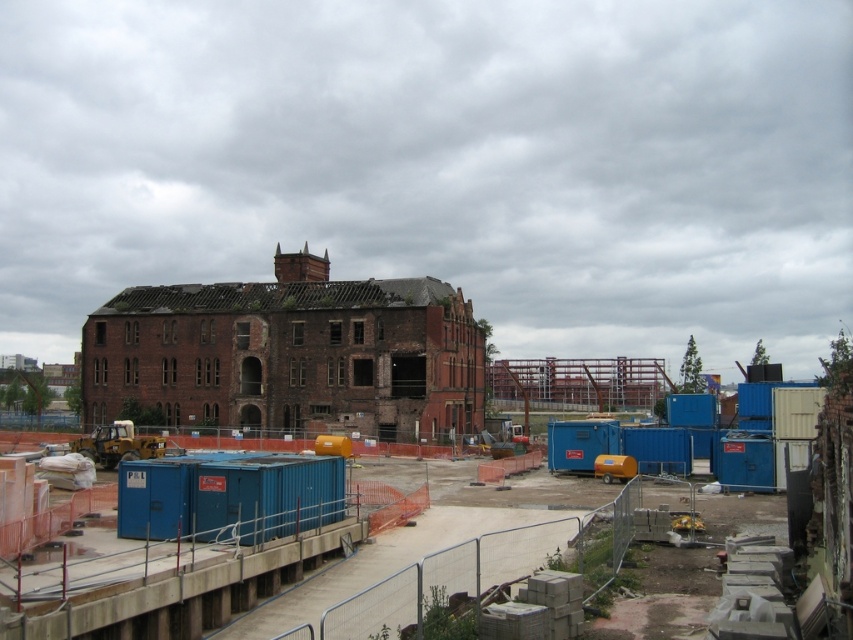
Between blue metallic containers at center and red brick building at center, which one appears on the left side from the viewer's perspective?

red brick building at center is more to the left.

Does blue metallic containers at center have a larger size compared to red brick building at center?

Actually, blue metallic containers at center might be smaller than red brick building at center.

Does point (67, 605) come in front of point (357, 346)?

Yes, point (67, 605) is in front of point (357, 346).

Locate an element on the screen. The height and width of the screenshot is (640, 853). blue metallic containers at center is located at coordinates (178, 563).